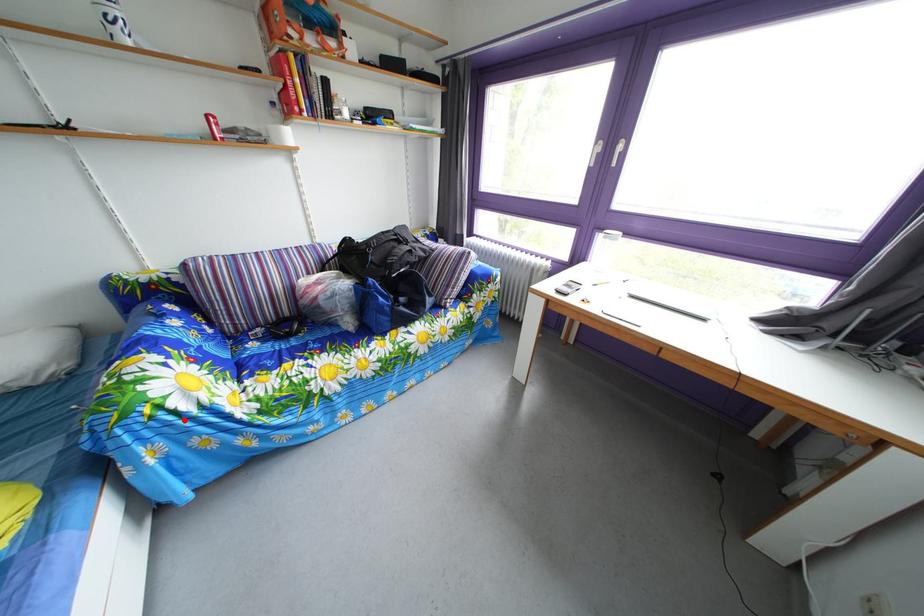
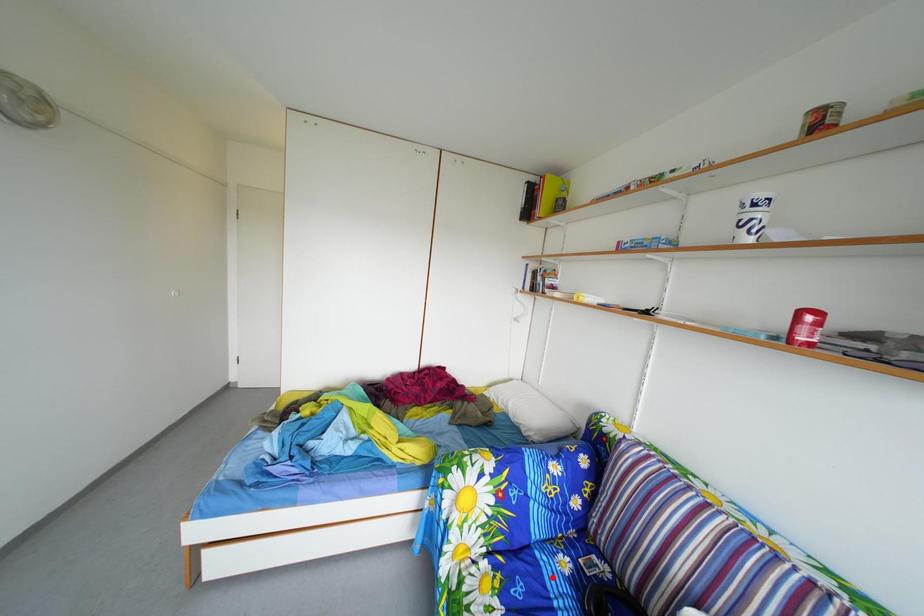
I am providing you with two images of the same scene from different viewpoints. A red point is marked on the first image and another point is marked on the second image. Does the point marked in image1 correspond to the same location as the one in image2?

No